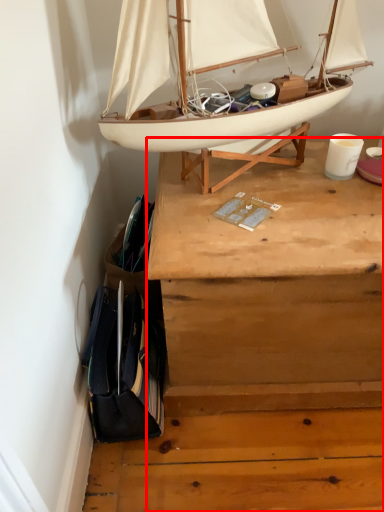
Question: From the image, what is the correct spatial relationship of desk (annotated by the red box) in relation to boat?

Choices:
 (A) left
 (B) right

Answer: (B)